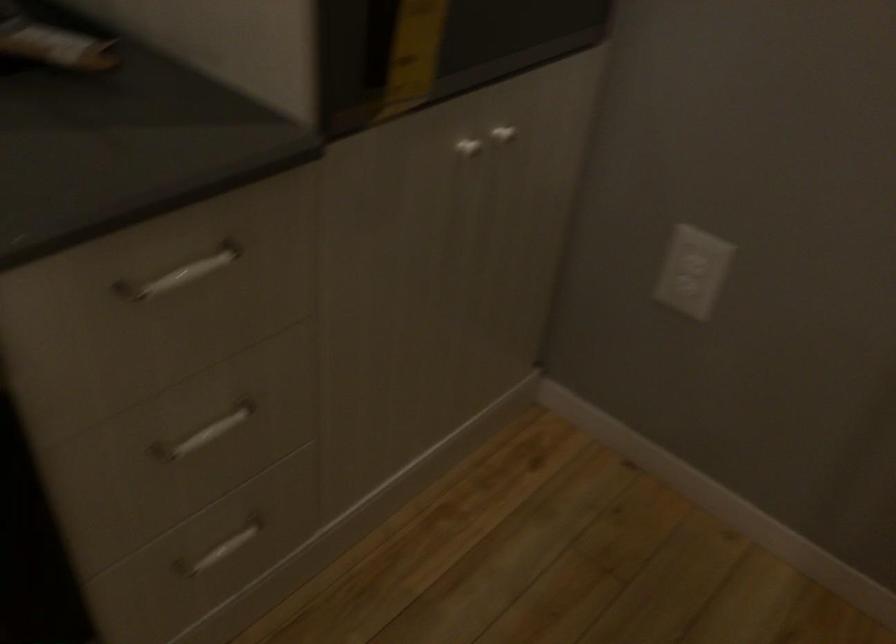
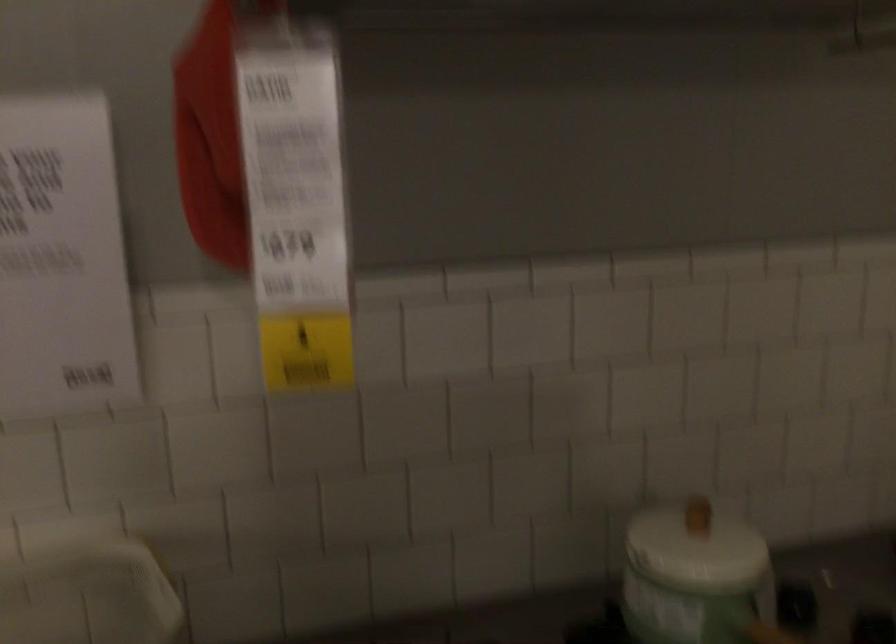
How did the camera likely rotate?

The camera rotated toward left-up.